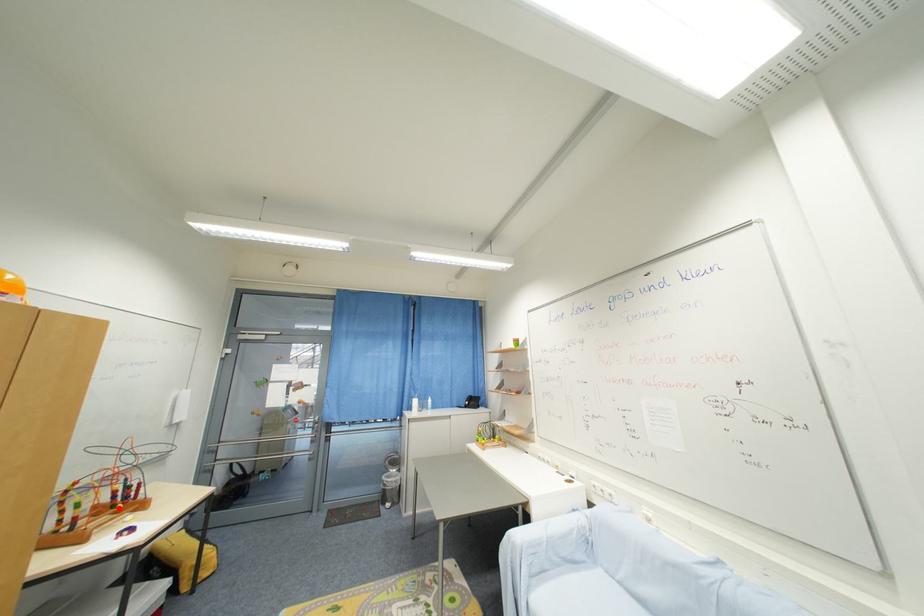
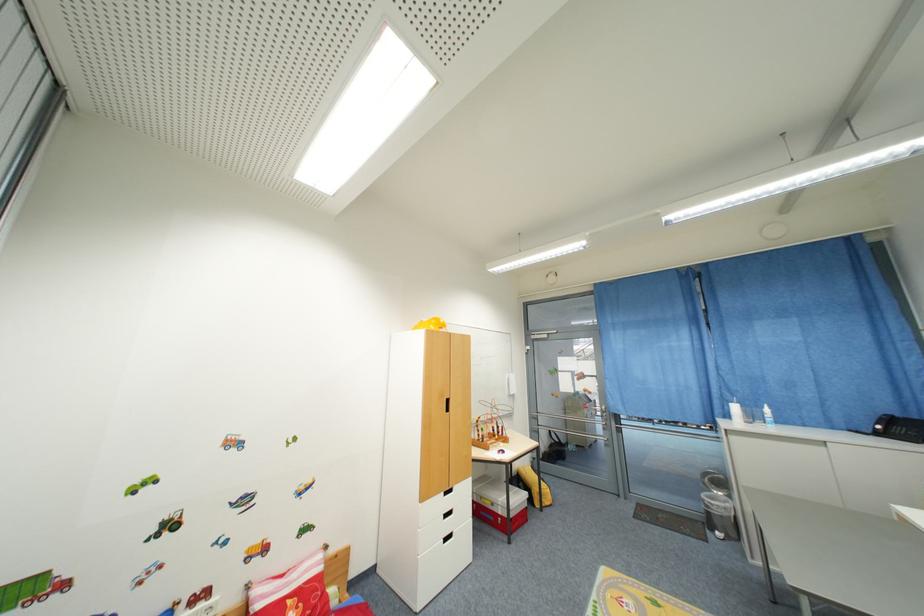
The point at the highlighted location is marked in the first image. Where is the corresponding point in the second image?

(500, 438)